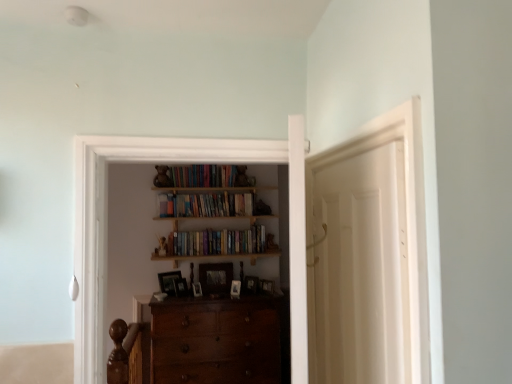
Where is `free spot in front of wooden picture frame at center, which is counted as the sixth picture frame, starting from the left`? The height and width of the screenshot is (384, 512). free spot in front of wooden picture frame at center, which is counted as the sixth picture frame, starting from the left is located at coordinates (250, 306).